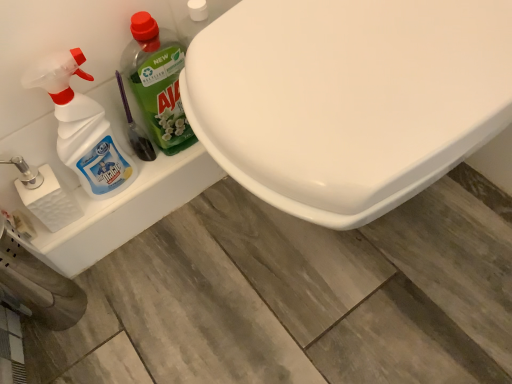
Question: From the image's perspective, relative to white textured toilet paper at left, is translucent plastic spray bottle at left, which is the 2th cleaning product in right-to-left order, above or below?

Choices:
 (A) above
 (B) below

Answer: (A)

Question: Is point (31, 72) closer or farther from the camera than point (26, 196)?

Choices:
 (A) closer
 (B) farther

Answer: (A)

Question: Which is nearer to the white textured toilet paper at left?

Choices:
 (A) green plastic bottle at left, the 2th cleaning product from the left
 (B) white glossy toilet at center
 (C) translucent plastic spray bottle at left, which is the 2th cleaning product in right-to-left order

Answer: (C)

Question: Which object is the farthest from the white textured toilet paper at left?

Choices:
 (A) white glossy toilet at center
 (B) green plastic bottle at left, positioned as the 1th cleaning product in right-to-left order
 (C) translucent plastic spray bottle at left, which is counted as the first cleaning product, starting from the left

Answer: (A)